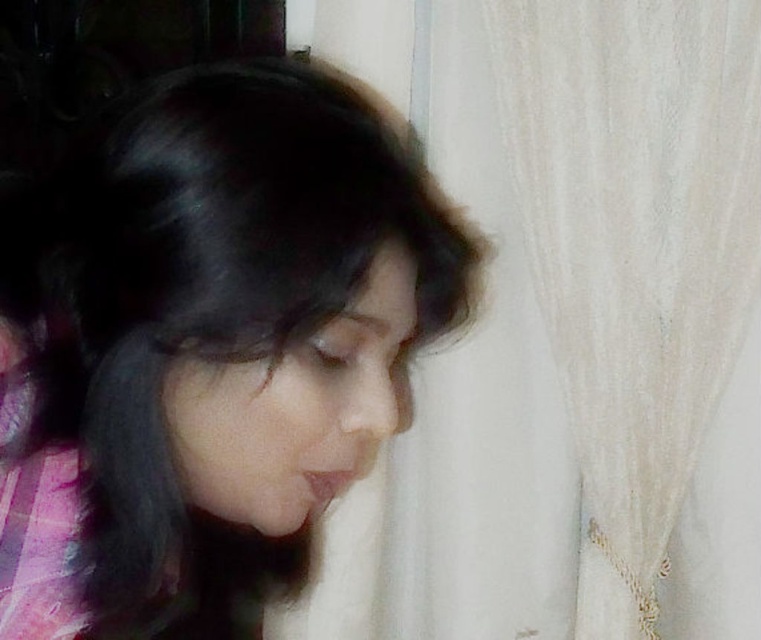
Question: Is white sheer curtain at upper right bigger than smooth black hair at center?

Choices:
 (A) no
 (B) yes

Answer: (B)

Question: Can you confirm if white sheer curtain at upper right is thinner than smooth black hair at center?

Choices:
 (A) yes
 (B) no

Answer: (B)

Question: Which point is farther to the camera?

Choices:
 (A) (40, 401)
 (B) (616, 170)

Answer: (B)

Question: Among these objects, which one is farthest from the camera?

Choices:
 (A) white sheer curtain at upper right
 (B) smooth black hair at center

Answer: (A)

Question: Which of the following is the closest to the observer?

Choices:
 (A) (752, 128)
 (B) (441, 272)

Answer: (B)

Question: Does white sheer curtain at upper right have a greater width compared to smooth black hair at center?

Choices:
 (A) no
 (B) yes

Answer: (B)